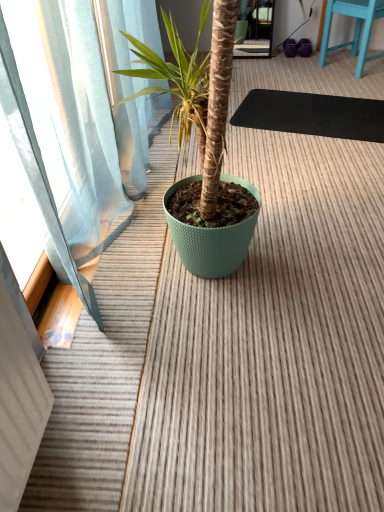
At what (x,y) coordinates should I click in order to perform the action: click on blue painted wood chair at upper right. Please return your answer as a coordinate pair (x, y). Looking at the image, I should click on (355, 28).

Image resolution: width=384 pixels, height=512 pixels. What do you see at coordinates (355, 28) in the screenshot? I see `blue painted wood chair at upper right` at bounding box center [355, 28].

What do you see at coordinates (312, 115) in the screenshot?
I see `black rubber yoga mat at center` at bounding box center [312, 115].

You are a GUI agent. You are given a task and a screenshot of the screen. Output one action in this format:
    pyautogui.click(x=<x>, y=<y>)
    Task: Click on the black rubber yoga mat at center
    This screenshot has height=512, width=384.
    Given the screenshot: What is the action you would take?
    pos(312,115)

The image size is (384, 512). I want to click on blue painted wood chair at upper right, so click(x=355, y=28).

Does blue painted wood chair at upper right appear on the right side of black rubber yoga mat at center?

Indeed, blue painted wood chair at upper right is positioned on the right side of black rubber yoga mat at center.

In the image, is blue painted wood chair at upper right positioned in front of or behind black rubber yoga mat at center?

In the image, blue painted wood chair at upper right appears behind black rubber yoga mat at center.

Which is nearer, [364,15] or [371,122]?

Point [364,15] is positioned farther from the camera compared to point [371,122].

From the image's perspective, which is above, blue painted wood chair at upper right or black rubber yoga mat at center?

blue painted wood chair at upper right is shown above in the image.

From a real-world perspective, relative to black rubber yoga mat at center, is blue painted wood chair at upper right vertically above or below?

blue painted wood chair at upper right is situated higher than black rubber yoga mat at center in the real world.

From the picture: Does blue painted wood chair at upper right have a greater width compared to black rubber yoga mat at center?

Incorrect, the width of blue painted wood chair at upper right does not surpass that of black rubber yoga mat at center.

Which of these two, blue painted wood chair at upper right or black rubber yoga mat at center, stands shorter?

black rubber yoga mat at center.

Is blue painted wood chair at upper right smaller than black rubber yoga mat at center?

No.

Do you think blue painted wood chair at upper right is within black rubber yoga mat at center, or outside of it?

blue painted wood chair at upper right is not inside black rubber yoga mat at center, it's outside.

Can you see blue painted wood chair at upper right touching black rubber yoga mat at center?

blue painted wood chair at upper right and black rubber yoga mat at center are clearly separated.

Is black rubber yoga mat at center at the back of blue painted wood chair at upper right?

Yes, blue painted wood chair at upper right's orientation is away from black rubber yoga mat at center.

How many degrees apart are the facing directions of blue painted wood chair at upper right and black rubber yoga mat at center?

The facing directions of blue painted wood chair at upper right and black rubber yoga mat at center are 54.6 degrees apart.

This screenshot has height=512, width=384. I want to click on furniture above the black rubber yoga mat at center (from a real-world perspective), so click(355, 28).

Does black rubber yoga mat at center appear on the left side of blue painted wood chair at upper right?

Yes.

Looking at this image, between black rubber yoga mat at center and blue painted wood chair at upper right, which one is positioned behind?

Positioned behind is blue painted wood chair at upper right.

Which point is more distant from viewer, (304, 108) or (362, 11)?

Positioned behind is point (362, 11).

From the image's perspective, is black rubber yoga mat at center above or below blue painted wood chair at upper right?

From the image's perspective, black rubber yoga mat at center appears below blue painted wood chair at upper right.

From a real-world perspective, does black rubber yoga mat at center sit lower than blue painted wood chair at upper right?

Correct, in the physical world, black rubber yoga mat at center is lower than blue painted wood chair at upper right.

From the picture: Considering the relative sizes of black rubber yoga mat at center and blue painted wood chair at upper right in the image provided, is black rubber yoga mat at center wider than blue painted wood chair at upper right?

Indeed, black rubber yoga mat at center has a greater width compared to blue painted wood chair at upper right.

Considering the sizes of objects black rubber yoga mat at center and blue painted wood chair at upper right in the image provided, who is taller, black rubber yoga mat at center or blue painted wood chair at upper right?

Standing taller between the two is blue painted wood chair at upper right.

Considering the sizes of objects black rubber yoga mat at center and blue painted wood chair at upper right in the image provided, who is bigger, black rubber yoga mat at center or blue painted wood chair at upper right?

blue painted wood chair at upper right is bigger.

Is blue painted wood chair at upper right completely or partially inside black rubber yoga mat at center?

No, blue painted wood chair at upper right is not inside black rubber yoga mat at center.

Is black rubber yoga mat at center placed right next to blue painted wood chair at upper right?

There is a gap between black rubber yoga mat at center and blue painted wood chair at upper right.

Could you tell me if black rubber yoga mat at center is facing blue painted wood chair at upper right?

No, black rubber yoga mat at center is not facing towards blue painted wood chair at upper right.

What's the angular difference between black rubber yoga mat at center and blue painted wood chair at upper right's facing directions?

There is a 54.6-degree angle between the facing directions of black rubber yoga mat at center and blue painted wood chair at upper right.

The image size is (384, 512). I want to click on yoga mat that appears below the blue painted wood chair at upper right (from a real-world perspective), so click(312, 115).

Where is `furniture behind the black rubber yoga mat at center`? furniture behind the black rubber yoga mat at center is located at coordinates (355, 28).

This screenshot has width=384, height=512. Identify the location of furniture on the right of black rubber yoga mat at center. pos(355,28).